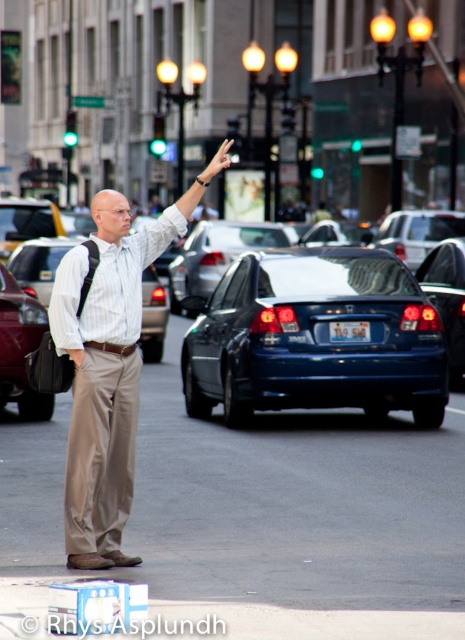
You are a pedestrian trying to hail a taxi. You see the yellow rubber taxi at center and the blue plastic license plate at center. Which object is taller?

The yellow rubber taxi at center is taller than the blue plastic license plate at center.

You are a pedestrian trying to cross the street. You see a shiny blue sedan at center and a matte black car at center. Which car is larger?

The shiny blue sedan at center is bigger than the matte black car at center.

Based on the photo, you are a delivery person who needs to cross the street from your current position to deliver a package. You see the light brown cotton pants at center and the matte black car at center. How far apart are these two objects?

The light brown cotton pants at center is 4.31 meters away from matte black car at center.